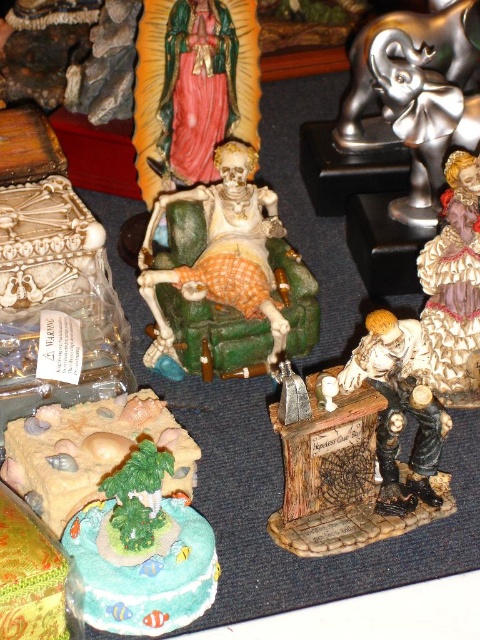
You are setting up a display and need to place the matte plastic skeleton at center and the matte plastic island at lower left. According to the scene, which object is on the right side of the other?

The matte plastic skeleton at center is positioned on the right side of the matte plastic island at lower left.

What is located at the coordinates point (143, 550)?

The location at point (143, 550) contains a matte plastic island at lower left.

You are organizing a miniature display and have two items to place on a shelf. You have a matte plastic island at lower left and a shiny silver elephant at upper right. Which item requires more space due to its larger size?

The shiny silver elephant at upper right requires more space because it is larger than the matte plastic island at lower left.